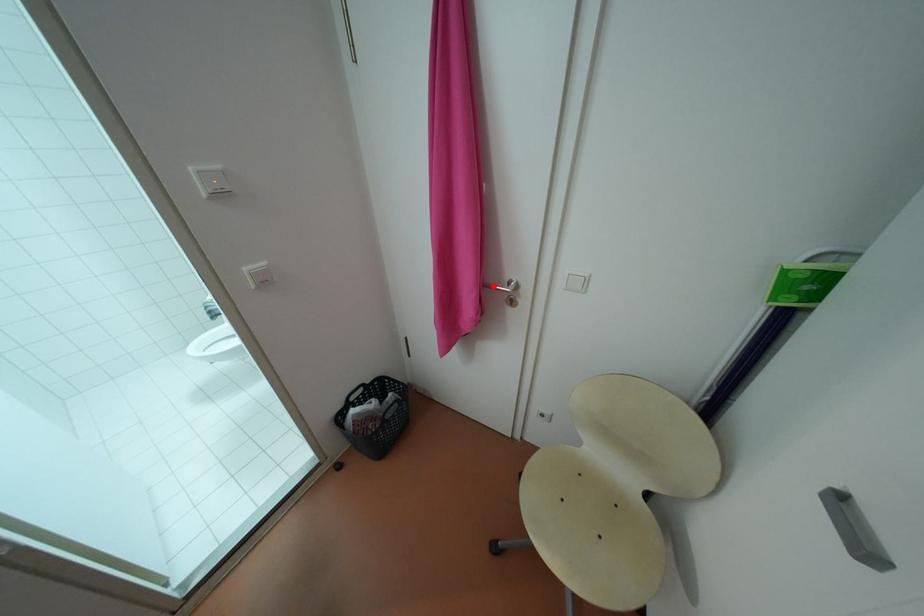
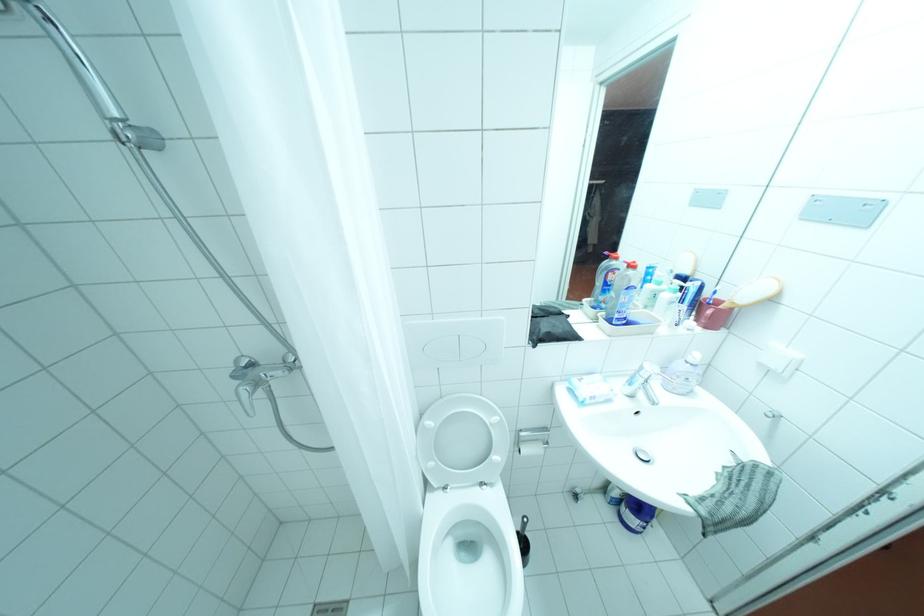
Question: I am providing you with two images of the same scene from different viewpoints. A red point is marked on the first image. Can you still see the location of the red point in image 2?

Choices:
 (A) Yes
 (B) No

Answer: (B)